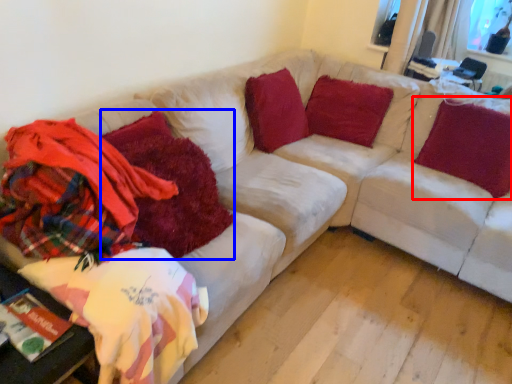
Question: Which object appears farthest to the camera in this image, pillow (highlighted by a red box) or blanket (highlighted by a blue box)?

Choices:
 (A) pillow
 (B) blanket

Answer: (A)